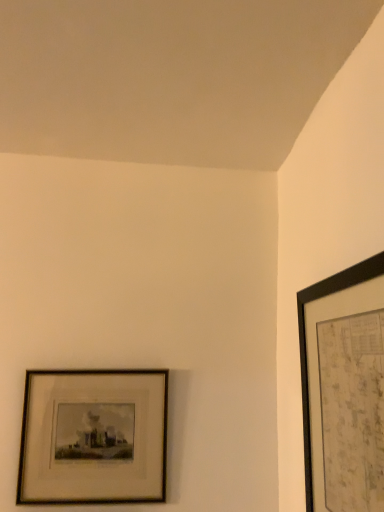
Locate an element on the screen. The image size is (384, 512). black matte picture frame at upper right, which appears as the 1th picture frame when viewed from the front is located at coordinates (344, 388).

Measure the distance between black matte picture frame at upper right, arranged as the 1th picture frame when viewed from the right, and camera.

The depth of black matte picture frame at upper right, arranged as the 1th picture frame when viewed from the right, is 20.47 inches.

What do you see at coordinates (344, 388) in the screenshot? Image resolution: width=384 pixels, height=512 pixels. I see `black matte picture frame at upper right, the second picture frame viewed from the back` at bounding box center [344, 388].

This screenshot has height=512, width=384. Describe the element at coordinates (93, 437) in the screenshot. I see `wooden framed print at lower left, acting as the second picture frame starting from the front` at that location.

Where is `wooden framed print at lower left, the second picture frame positioned from the right`? wooden framed print at lower left, the second picture frame positioned from the right is located at coordinates (93, 437).

Find the location of `black matte picture frame at upper right, the second picture frame viewed from the back`. black matte picture frame at upper right, the second picture frame viewed from the back is located at coordinates (344, 388).

Is black matte picture frame at upper right, the second picture frame viewed from the back, at the right side of wooden framed print at lower left, placed as the 1th picture frame when sorted from back to front?

Yes, black matte picture frame at upper right, the second picture frame viewed from the back, is to the right of wooden framed print at lower left, placed as the 1th picture frame when sorted from back to front.

Is the position of black matte picture frame at upper right, arranged as the 1th picture frame when viewed from the right, more distant than that of wooden framed print at lower left, which is the first picture frame in left-to-right order?

No, black matte picture frame at upper right, arranged as the 1th picture frame when viewed from the right, is in front of wooden framed print at lower left, which is the first picture frame in left-to-right order.

Which is nearer, (365, 372) or (57, 478)?

Point (365, 372) appears to be closer to the viewer than point (57, 478).

From the image's perspective, is black matte picture frame at upper right, which appears as the 1th picture frame when viewed from the front, on wooden framed print at lower left, the second picture frame positioned from the right?

Yes, from the image's perspective, black matte picture frame at upper right, which appears as the 1th picture frame when viewed from the front, is over wooden framed print at lower left, the second picture frame positioned from the right.

From a real-world perspective, is black matte picture frame at upper right, the 2th picture frame positioned from the left, located beneath wooden framed print at lower left, which is the first picture frame in left-to-right order?

No, from a real-world perspective, black matte picture frame at upper right, the 2th picture frame positioned from the left, is not beneath wooden framed print at lower left, which is the first picture frame in left-to-right order.

Can you confirm if black matte picture frame at upper right, the second picture frame viewed from the back, is wider than wooden framed print at lower left, placed as the 1th picture frame when sorted from back to front?

Correct, the width of black matte picture frame at upper right, the second picture frame viewed from the back, exceeds that of wooden framed print at lower left, placed as the 1th picture frame when sorted from back to front.

Considering the sizes of objects black matte picture frame at upper right, which appears as the 1th picture frame when viewed from the front, and wooden framed print at lower left, placed as the 1th picture frame when sorted from back to front, in the image provided, who is shorter, black matte picture frame at upper right, which appears as the 1th picture frame when viewed from the front, or wooden framed print at lower left, placed as the 1th picture frame when sorted from back to front,?

Standing shorter between the two is wooden framed print at lower left, placed as the 1th picture frame when sorted from back to front.

Between black matte picture frame at upper right, the 2th picture frame positioned from the left, and wooden framed print at lower left, which is the first picture frame in left-to-right order, which one has smaller size?

wooden framed print at lower left, which is the first picture frame in left-to-right order, is smaller.

From the picture: Is wooden framed print at lower left, the second picture frame positioned from the right, completely or partially inside black matte picture frame at upper right, the second picture frame viewed from the back?

No, wooden framed print at lower left, the second picture frame positioned from the right, is not a part of black matte picture frame at upper right, the second picture frame viewed from the back.

Is black matte picture frame at upper right, arranged as the 1th picture frame when viewed from the right, next to wooden framed print at lower left, the second picture frame positioned from the right, and touching it?

black matte picture frame at upper right, arranged as the 1th picture frame when viewed from the right, and wooden framed print at lower left, the second picture frame positioned from the right, are clearly separated.

Is black matte picture frame at upper right, the 2th picture frame positioned from the left, turned away from wooden framed print at lower left, the second picture frame positioned from the right?

No, black matte picture frame at upper right, the 2th picture frame positioned from the left,'s orientation is not away from wooden framed print at lower left, the second picture frame positioned from the right.

There is a wooden framed print at lower left, placed as the 1th picture frame when sorted from back to front. At what (x,y) coordinates should I click in order to perform the action: click on picture frame above it (from a real-world perspective). Please return your answer as a coordinate pair (x, y). This screenshot has width=384, height=512. Looking at the image, I should click on (344, 388).

Considering the relative positions of wooden framed print at lower left, the second picture frame positioned from the right, and black matte picture frame at upper right, the 2th picture frame positioned from the left, in the image provided, is wooden framed print at lower left, the second picture frame positioned from the right, to the left or to the right of black matte picture frame at upper right, the 2th picture frame positioned from the left,?

wooden framed print at lower left, the second picture frame positioned from the right, is to the left of black matte picture frame at upper right, the 2th picture frame positioned from the left.

In the image, is wooden framed print at lower left, acting as the second picture frame starting from the front, positioned in front of or behind black matte picture frame at upper right, the 2th picture frame positioned from the left?

In the image, wooden framed print at lower left, acting as the second picture frame starting from the front, appears behind black matte picture frame at upper right, the 2th picture frame positioned from the left.

Is point (58, 492) less distant than point (340, 504)?

No, it is behind (340, 504).

From the image's perspective, between wooden framed print at lower left, the second picture frame positioned from the right, and black matte picture frame at upper right, which appears as the 1th picture frame when viewed from the front, which one is located above?

black matte picture frame at upper right, which appears as the 1th picture frame when viewed from the front, from the image's perspective.

From a real-world perspective, relative to black matte picture frame at upper right, which appears as the 1th picture frame when viewed from the front, is wooden framed print at lower left, placed as the 1th picture frame when sorted from back to front, vertically above or below?

In terms of real-world spatial position, wooden framed print at lower left, placed as the 1th picture frame when sorted from back to front, is below black matte picture frame at upper right, which appears as the 1th picture frame when viewed from the front.

Does wooden framed print at lower left, which is the first picture frame in left-to-right order, have a greater width compared to black matte picture frame at upper right, which appears as the 1th picture frame when viewed from the front?

In fact, wooden framed print at lower left, which is the first picture frame in left-to-right order, might be narrower than black matte picture frame at upper right, which appears as the 1th picture frame when viewed from the front.

From the picture: Considering the sizes of objects wooden framed print at lower left, acting as the second picture frame starting from the front, and black matte picture frame at upper right, the 2th picture frame positioned from the left, in the image provided, who is taller, wooden framed print at lower left, acting as the second picture frame starting from the front, or black matte picture frame at upper right, the 2th picture frame positioned from the left,?

With more height is black matte picture frame at upper right, the 2th picture frame positioned from the left.

Can you confirm if wooden framed print at lower left, acting as the second picture frame starting from the front, is bigger than black matte picture frame at upper right, arranged as the 1th picture frame when viewed from the right?

Actually, wooden framed print at lower left, acting as the second picture frame starting from the front, might be smaller than black matte picture frame at upper right, arranged as the 1th picture frame when viewed from the right.

Does wooden framed print at lower left, acting as the second picture frame starting from the front, contain black matte picture frame at upper right, the 2th picture frame positioned from the left?

No, black matte picture frame at upper right, the 2th picture frame positioned from the left, is located outside of wooden framed print at lower left, acting as the second picture frame starting from the front.

Consider the image. Is there a large distance between wooden framed print at lower left, the second picture frame positioned from the right, and black matte picture frame at upper right, the second picture frame viewed from the back?

They are positioned close to each other.

Is wooden framed print at lower left, the second picture frame positioned from the right, aimed at black matte picture frame at upper right, the 2th picture frame positioned from the left?

No.

What's the angular difference between wooden framed print at lower left, placed as the 1th picture frame when sorted from back to front, and black matte picture frame at upper right, the 2th picture frame positioned from the left,'s facing directions?

There is a 91.9-degree angle between the facing directions of wooden framed print at lower left, placed as the 1th picture frame when sorted from back to front, and black matte picture frame at upper right, the 2th picture frame positioned from the left.

Measure the distance between wooden framed print at lower left, placed as the 1th picture frame when sorted from back to front, and black matte picture frame at upper right, which appears as the 1th picture frame when viewed from the front.

They are 20.60 inches apart.

At what (x,y) coordinates should I click in order to perform the action: click on picture frame that appears below the black matte picture frame at upper right, the second picture frame viewed from the back (from a real-world perspective). Please return your answer as a coordinate pair (x, y). This screenshot has width=384, height=512. Looking at the image, I should click on (93, 437).

Locate an element on the screen. This screenshot has height=512, width=384. picture frame located above the wooden framed print at lower left, acting as the second picture frame starting from the front (from the image's perspective) is located at coordinates (344, 388).

At what (x,y) coordinates should I click in order to perform the action: click on picture frame below the black matte picture frame at upper right, which appears as the 1th picture frame when viewed from the front (from the image's perspective). Please return your answer as a coordinate pair (x, y). Looking at the image, I should click on (93, 437).